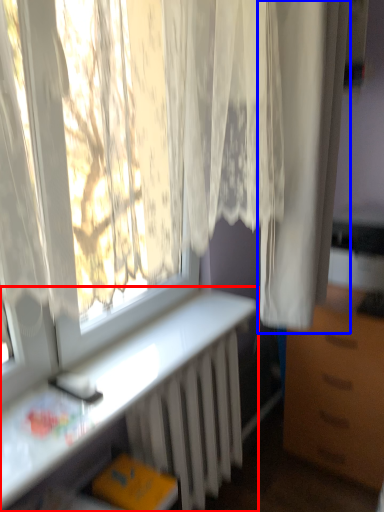
Question: Which object appears closest to the camera in this image, desk (highlighted by a red box) or curtain (highlighted by a blue box)?

Choices:
 (A) desk
 (B) curtain

Answer: (A)